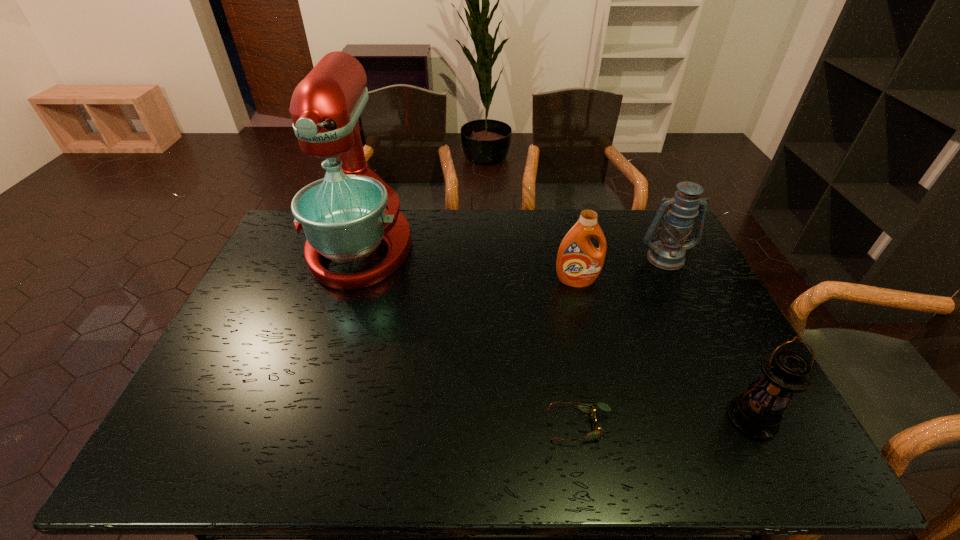
At what (x,y) coordinates should I click in order to perform the action: click on free point between the nearer lantern and the farther lantern. Please return your answer as a coordinate pair (x, y). Image resolution: width=960 pixels, height=540 pixels. Looking at the image, I should click on (708, 339).

At what (x,y) coordinates should I click in order to perform the action: click on vacant area that lies between the mixer and the detergent. Please return your answer as a coordinate pair (x, y). This screenshot has height=540, width=960. Looking at the image, I should click on (468, 264).

Where is `vacant area that lies between the detergent and the tallest object`? vacant area that lies between the detergent and the tallest object is located at coordinates (468, 264).

Image resolution: width=960 pixels, height=540 pixels. I want to click on free spot between the tallest object and the farther lantern, so click(513, 252).

Where is `object that is the second closest to the mixer`? object that is the second closest to the mixer is located at coordinates (588, 408).

What are the coordinates of `object identified as the third closest to the leftmost object` in the screenshot? It's located at (668, 253).